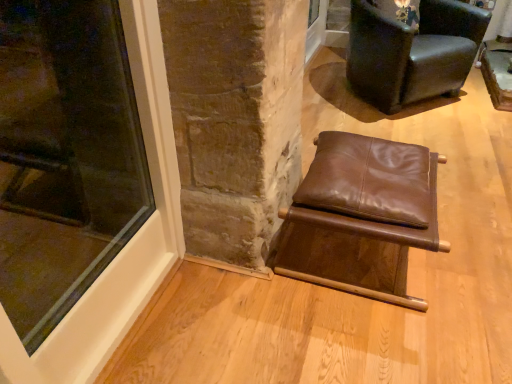
Find the location of a particular element. dark brown leather chair at upper right, positioned as the 2th chair in front-to-back order is located at coordinates (412, 52).

From a real-world perspective, is transparent glass window at lower left positioned under dark brown leather chair at upper right, the second chair when ordered from bottom to top, based on gravity?

Actually, transparent glass window at lower left is physically above dark brown leather chair at upper right, the second chair when ordered from bottom to top, in the real world.

From the picture: From the image's perspective, is transparent glass window at lower left located above or below dark brown leather chair at upper right, the second chair when ordered from bottom to top?

From the image's perspective, transparent glass window at lower left appears below dark brown leather chair at upper right, the second chair when ordered from bottom to top.

Is transparent glass window at lower left aimed at dark brown leather chair at upper right, placed as the first chair when sorted from back to front?

No, transparent glass window at lower left does not turn towards dark brown leather chair at upper right, placed as the first chair when sorted from back to front.

From a real-world perspective, which chair is the 1st one underneath the transparent glass window at lower left? Please provide its 2D coordinates.

[(412, 52)]

From a real-world perspective, is brown leather stool at center, marked as the 1th chair in a bottom-to-top arrangement, below transparent glass window at lower left?

Yes, from a real-world perspective, brown leather stool at center, marked as the 1th chair in a bottom-to-top arrangement, is under transparent glass window at lower left.

Is transparent glass window at lower left at the back of brown leather stool at center, the second chair from the top?

That's not correct — brown leather stool at center, the second chair from the top, is not looking away from transparent glass window at lower left.

Is brown leather stool at center, the 1th chair from the front, thinner than transparent glass window at lower left?

In fact, brown leather stool at center, the 1th chair from the front, might be wider than transparent glass window at lower left.

From their relative heights in the image, would you say brown leather stool at center, marked as the 2th chair in a back-to-front arrangement, is taller or shorter than transparent glass window at lower left?

brown leather stool at center, marked as the 2th chair in a back-to-front arrangement, is shorter than transparent glass window at lower left.

From the image's perspective, who appears lower, brown leather stool at center, the 1th chair from the front, or dark brown leather chair at upper right, the second chair when ordered from bottom to top?

brown leather stool at center, the 1th chair from the front, appears lower in the image.

Could you measure the distance between brown leather stool at center, the 1th chair from the front, and dark brown leather chair at upper right, the second chair when ordered from bottom to top?

A distance of 4.33 feet exists between brown leather stool at center, the 1th chair from the front, and dark brown leather chair at upper right, the second chair when ordered from bottom to top.

Which is behind, brown leather stool at center, marked as the 2th chair in a back-to-front arrangement, or dark brown leather chair at upper right, positioned as the 2th chair in front-to-back order?

dark brown leather chair at upper right, positioned as the 2th chair in front-to-back order, is further away from the camera.

Based on the photo, from a real-world perspective, who is located lower, brown leather stool at center, marked as the 2th chair in a back-to-front arrangement, or dark brown leather chair at upper right, the second chair when ordered from bottom to top?

From a 3D spatial view, brown leather stool at center, marked as the 2th chair in a back-to-front arrangement, is below.

Does transparent glass window at lower left appear on the left side of brown leather stool at center, marked as the 1th chair in a bottom-to-top arrangement?

Yes, transparent glass window at lower left is to the left of brown leather stool at center, marked as the 1th chair in a bottom-to-top arrangement.

Can you tell me how much transparent glass window at lower left and brown leather stool at center, marked as the 2th chair in a back-to-front arrangement, differ in facing direction?

They differ by 0.693 degrees in their facing directions.

Consider the image. Does transparent glass window at lower left have a lesser width compared to brown leather stool at center, the second chair from the top?

Correct, the width of transparent glass window at lower left is less than that of brown leather stool at center, the second chair from the top.

From the image's perspective, is transparent glass window at lower left above brown leather stool at center, the second chair from the top?

Yes, from the image's perspective, transparent glass window at lower left is on top of brown leather stool at center, the second chair from the top.

Is point (419, 34) closer or farther from the camera than point (368, 145)?

Clearly, point (419, 34) is more distant from the camera than point (368, 145).

From the image's perspective, is dark brown leather chair at upper right, which appears as the first chair when viewed from the top, positioned above or below brown leather stool at center, the second chair from the top?

dark brown leather chair at upper right, which appears as the first chair when viewed from the top, is above brown leather stool at center, the second chair from the top.

Between dark brown leather chair at upper right, positioned as the 2th chair in front-to-back order, and brown leather stool at center, the second chair from the top, which one is positioned in front?

brown leather stool at center, the second chair from the top, is in front.

Is dark brown leather chair at upper right, positioned as the 2th chair in front-to-back order, inside the boundaries of brown leather stool at center, the 1th chair from the front, or outside?

dark brown leather chair at upper right, positioned as the 2th chair in front-to-back order, is located beyond the bounds of brown leather stool at center, the 1th chair from the front.

From a real-world perspective, count 1st chairs downward from the transparent glass window at lower left and point to it. Please provide its 2D coordinates.

[(412, 52)]

Is dark brown leather chair at upper right, positioned as the 2th chair in front-to-back order, thinner than transparent glass window at lower left?

No.

From a real-world perspective, is dark brown leather chair at upper right, the second chair when ordered from bottom to top, positioned above or below transparent glass window at lower left?

In terms of real-world spatial position, dark brown leather chair at upper right, the second chair when ordered from bottom to top, is below transparent glass window at lower left.

Is dark brown leather chair at upper right, positioned as the 2th chair in front-to-back order, turned away from transparent glass window at lower left?

No.

Locate an element on the screen. Image resolution: width=512 pixels, height=384 pixels. window above the dark brown leather chair at upper right, which appears as the first chair when viewed from the top (from a real-world perspective) is located at coordinates (128, 242).

Starting from the transparent glass window at lower left, which chair is the 1st one behind? Please provide its 2D coordinates.

[(362, 217)]

Considering their positions, is dark brown leather chair at upper right, positioned as the 2th chair in front-to-back order, positioned closer to transparent glass window at lower left than brown leather stool at center, marked as the 1th chair in a bottom-to-top arrangement?

The object closer to transparent glass window at lower left is brown leather stool at center, marked as the 1th chair in a bottom-to-top arrangement.

Estimate the real-world distances between objects in this image. Which object is closer to brown leather stool at center, marked as the 2th chair in a back-to-front arrangement, transparent glass window at lower left or dark brown leather chair at upper right, which appears as the first chair when viewed from the top?

transparent glass window at lower left lies closer to brown leather stool at center, marked as the 2th chair in a back-to-front arrangement, than the other object.

Based on their spatial positions, is brown leather stool at center, the 1th chair from the front, or transparent glass window at lower left closer to dark brown leather chair at upper right, which appears as the first chair when viewed from the top?

brown leather stool at center, the 1th chair from the front, is positioned closer to the anchor dark brown leather chair at upper right, which appears as the first chair when viewed from the top.

From the image, which object appears to be farther from dark brown leather chair at upper right, positioned as the 2th chair in front-to-back order, transparent glass window at lower left or brown leather stool at center, the second chair from the top?

The object further to dark brown leather chair at upper right, positioned as the 2th chair in front-to-back order, is transparent glass window at lower left.

Looking at the image, which one is located further to transparent glass window at lower left, brown leather stool at center, the 1th chair from the front, or dark brown leather chair at upper right, which appears as the first chair when viewed from the top?

Among the two, dark brown leather chair at upper right, which appears as the first chair when viewed from the top, is located further to transparent glass window at lower left.

From the image, which object appears to be nearer to brown leather stool at center, marked as the 1th chair in a bottom-to-top arrangement, dark brown leather chair at upper right, placed as the first chair when sorted from back to front, or transparent glass window at lower left?

transparent glass window at lower left.

The width and height of the screenshot is (512, 384). In order to click on chair between transparent glass window at lower left and dark brown leather chair at upper right, the second chair when ordered from bottom to top, from front to back in this screenshot , I will do `click(362, 217)`.